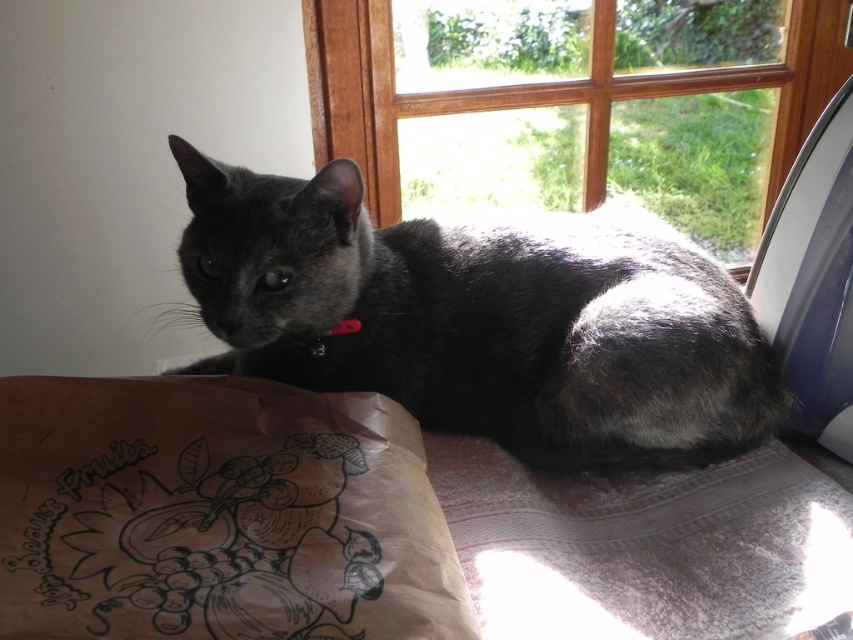
Question: Which object appears farthest from the camera in this image?

Choices:
 (A) brown paper bag at lower left
 (B) black fabric neckband at center

Answer: (B)

Question: In this image, where is shiny black cat at center located relative to brown paper bag at lower left?

Choices:
 (A) left
 (B) right

Answer: (B)

Question: Which of the following is the closest to the observer?

Choices:
 (A) (527, 188)
 (B) (73, 420)

Answer: (B)

Question: Is brown paper bag at lower left above wooden frame at upper center?

Choices:
 (A) no
 (B) yes

Answer: (A)

Question: From the image, what is the correct spatial relationship of brown paper bag at lower left in relation to wooden frame at upper center?

Choices:
 (A) right
 (B) left

Answer: (B)

Question: Which point is farther from the camera taking this photo?

Choices:
 (A) (637, 260)
 (B) (714, 36)
 (C) (401, 625)
 (D) (341, 328)

Answer: (B)